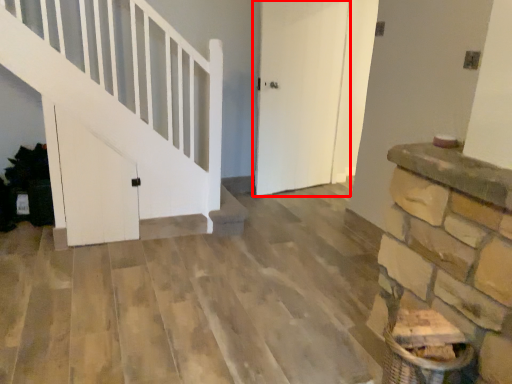
Question: From the image, what is the correct spatial relationship of door (annotated by the red box) in relation to door?

Choices:
 (A) right
 (B) left

Answer: (A)